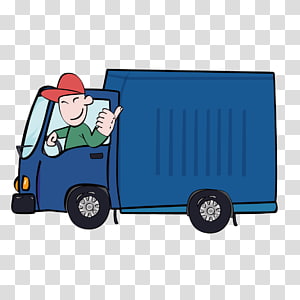
The width and height of the screenshot is (300, 300). Find the location of `door`. door is located at coordinates (58, 173).